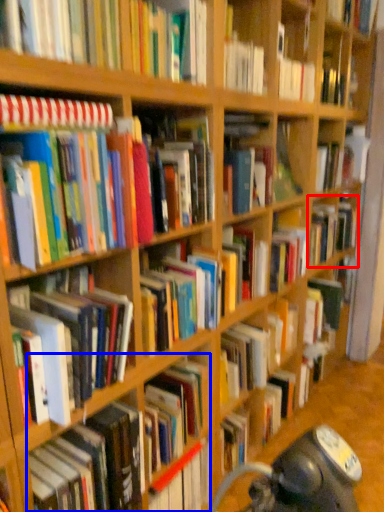
Question: Which point is closer to the camera, book (highlighted by a red box) or book (highlighted by a blue box)?

Choices:
 (A) book
 (B) book

Answer: (B)